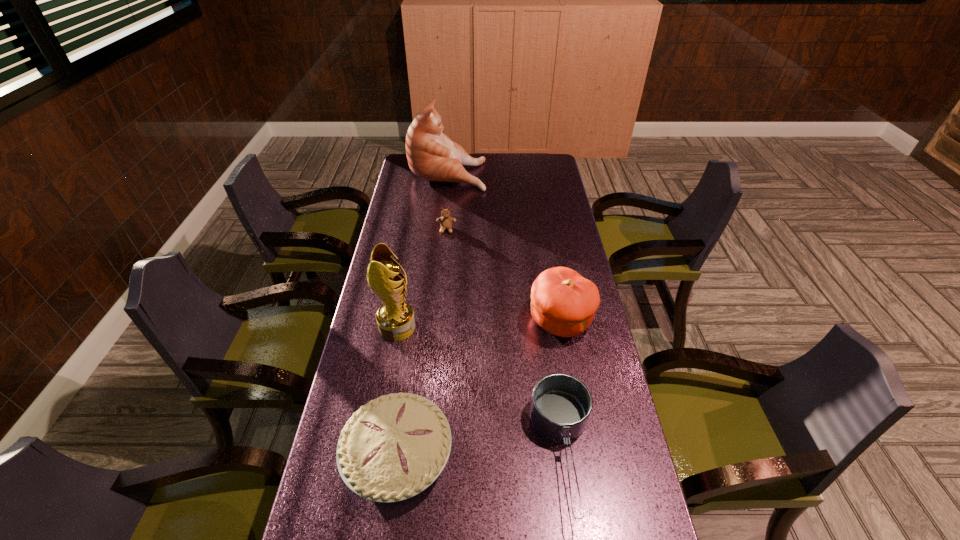
The image size is (960, 540). I want to click on vacant space located on the front-facing side of the fifth nearest object, so click(440, 305).

This screenshot has width=960, height=540. Find the location of `object that is at the far edge`. object that is at the far edge is located at coordinates (432, 155).

At what (x,y) coordinates should I click in order to perform the action: click on cat present at the left edge. Please return your answer as a coordinate pair (x, y). Looking at the image, I should click on coord(432,155).

Identify the location of award located at the left edge. (395, 318).

Where is `pie that is at the left edge`? This screenshot has height=540, width=960. pie that is at the left edge is located at coordinates (394, 447).

The height and width of the screenshot is (540, 960). In order to click on pumpkin located in the right edge section of the desktop in this screenshot , I will do `click(563, 302)`.

Locate an element on the screen. saucepan that is at the right edge is located at coordinates (561, 404).

The image size is (960, 540). Identify the location of object that is at the far left corner. (432, 155).

Identify the location of vacant space at the left edge. The width and height of the screenshot is (960, 540). (318, 501).

This screenshot has width=960, height=540. Identify the location of vacant space at the right edge of the desktop. (561, 368).